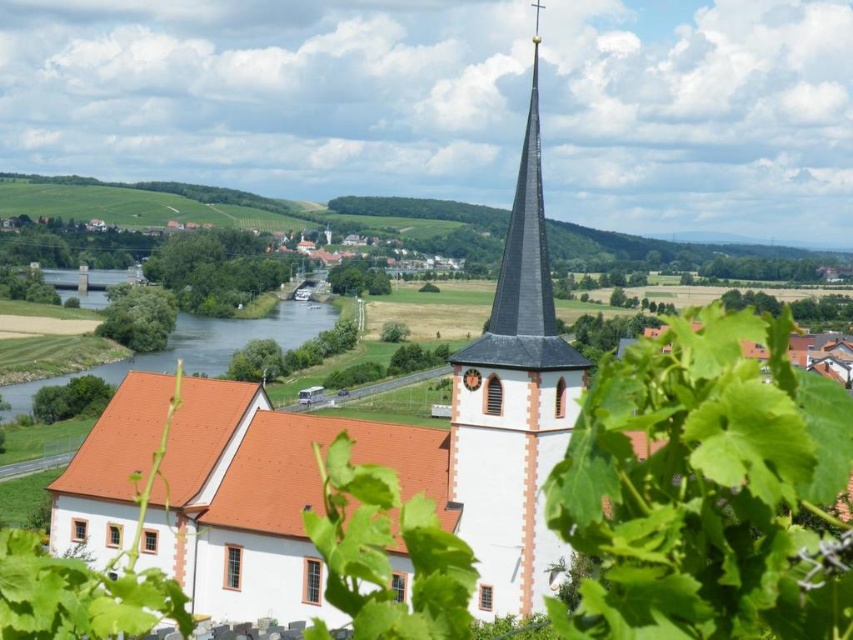
You are standing at the center of the image and want to locate the white stucco church at center. According to the coordinates provided, in which direction should you look relative to your current position?

The white stucco church at center is located at coordinates point (511,412). Since you are at the center of the image, which is point (426,320), the church is northeast of your current position because its x and y coordinates are both higher than the center point.